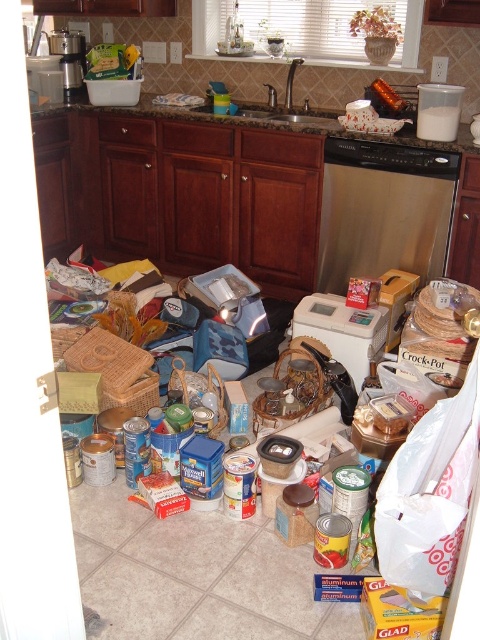
Question: Can you confirm if satin nickel faucet at center is thinner than metallic coffee maker at upper left?

Choices:
 (A) yes
 (B) no

Answer: (B)

Question: Among these points, which one is farthest from the camera?

Choices:
 (A) (289, 83)
 (B) (51, 52)
 (C) (331, 205)
 (D) (335, 314)

Answer: (B)

Question: Can you confirm if stainless steel dishwasher at center is positioned above brown granite countertop at center?

Choices:
 (A) no
 (B) yes

Answer: (A)

Question: Which point appears closest to the camera in this image?

Choices:
 (A) (149, 104)
 (B) (376, 348)

Answer: (B)

Question: Does stainless steel dishwasher at center appear over white plastic toaster at center?

Choices:
 (A) no
 (B) yes

Answer: (B)

Question: Considering the real-world distances, which object is closest to the white plastic toaster at center?

Choices:
 (A) satin nickel faucet at center
 (B) brown granite countertop at center
 (C) stainless steel dishwasher at center

Answer: (C)